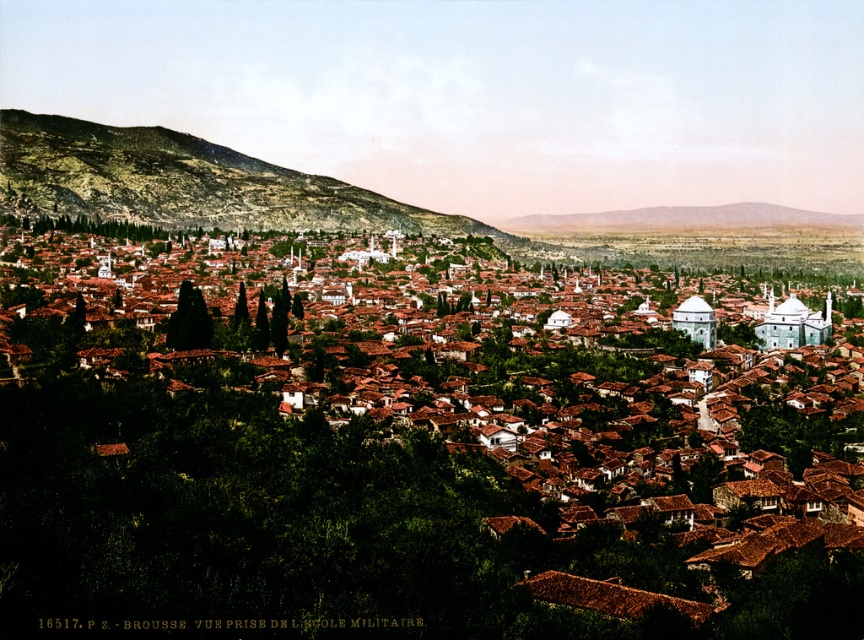
Question: Among these objects, which one is farthest from the camera?

Choices:
 (A) brown clay rooftops at center
 (B) green grassy hillside at left

Answer: (B)

Question: Does brown clay rooftops at center appear on the left side of green grassy hillside at left?

Choices:
 (A) no
 (B) yes

Answer: (A)

Question: Is brown clay rooftops at center closer to the viewer compared to green grassy hillside at left?

Choices:
 (A) no
 (B) yes

Answer: (B)

Question: Where is brown clay rooftops at center located in relation to green grassy hillside at left in the image?

Choices:
 (A) left
 (B) right

Answer: (B)

Question: Which point appears closest to the camera in this image?

Choices:
 (A) (542, 477)
 (B) (60, 136)

Answer: (A)